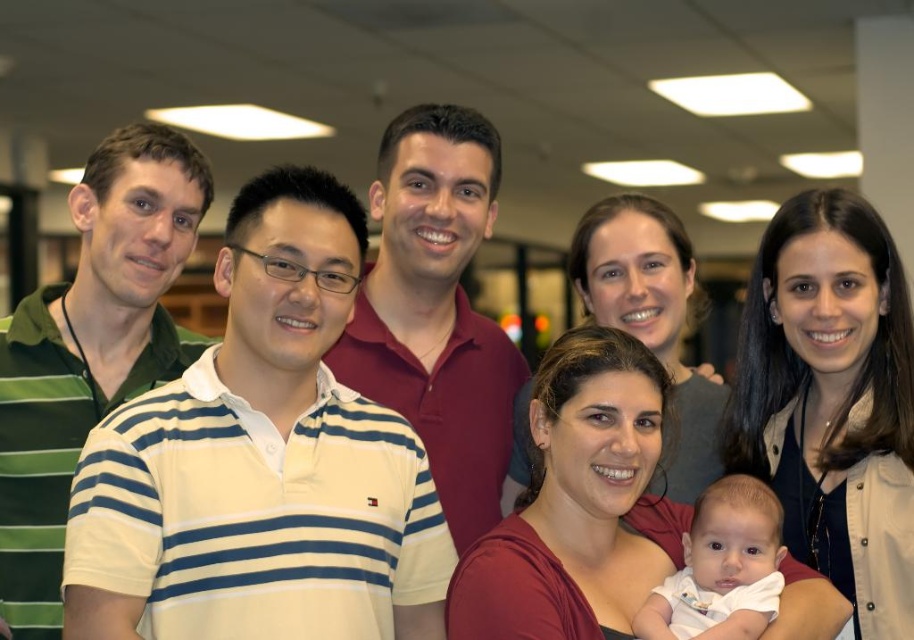
Question: Which point is closer to the camera?

Choices:
 (A) (215, 275)
 (B) (721, 561)
 (C) (434, 262)

Answer: (A)

Question: Which point is closer to the camera taking this photo?

Choices:
 (A) (771, 568)
 (B) (264, 582)
 (C) (492, 465)

Answer: (B)

Question: Considering the real-world distances, which object is closest to the striped cotton polo shirt at center?

Choices:
 (A) maroon cotton polo shirt at center
 (B) green striped polo shirt at left
 (C) white soft baby at center

Answer: (A)

Question: In this image, where is striped cotton polo shirt at center located relative to white soft baby at center?

Choices:
 (A) left
 (B) right

Answer: (A)

Question: Does green striped polo shirt at left appear on the left side of maroon cotton polo shirt at center?

Choices:
 (A) no
 (B) yes

Answer: (B)

Question: Does striped cotton polo shirt at center have a smaller size compared to maroon cotton polo shirt at center?

Choices:
 (A) no
 (B) yes

Answer: (A)